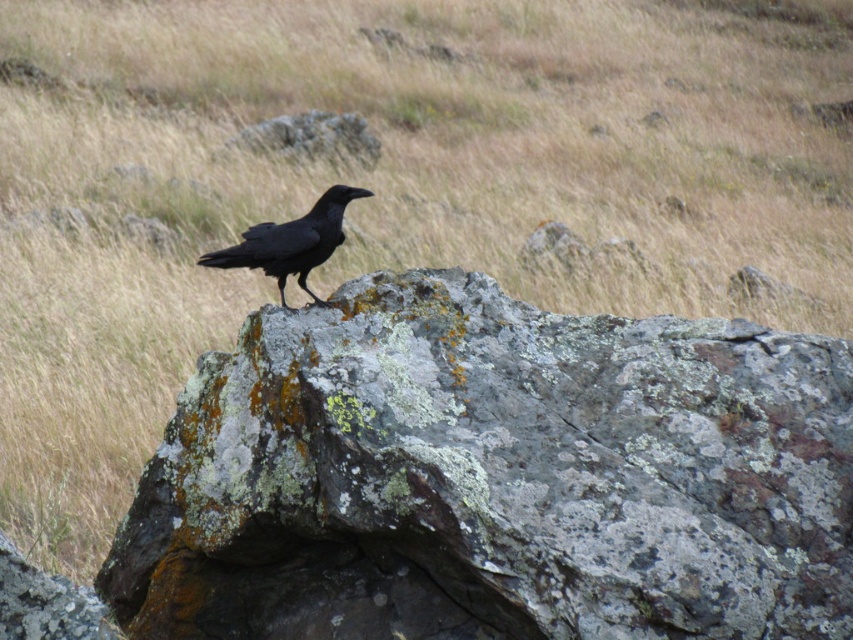
Can you confirm if lichen-covered rock at center is wider than shiny black raven at center?

Yes.

Does point (294, 472) come in front of point (312, 224)?

That is True.

This screenshot has width=853, height=640. Describe the element at coordinates (494, 477) in the screenshot. I see `lichen-covered rock at center` at that location.

Locate an element on the screen. The image size is (853, 640). lichen-covered rock at center is located at coordinates (494, 477).